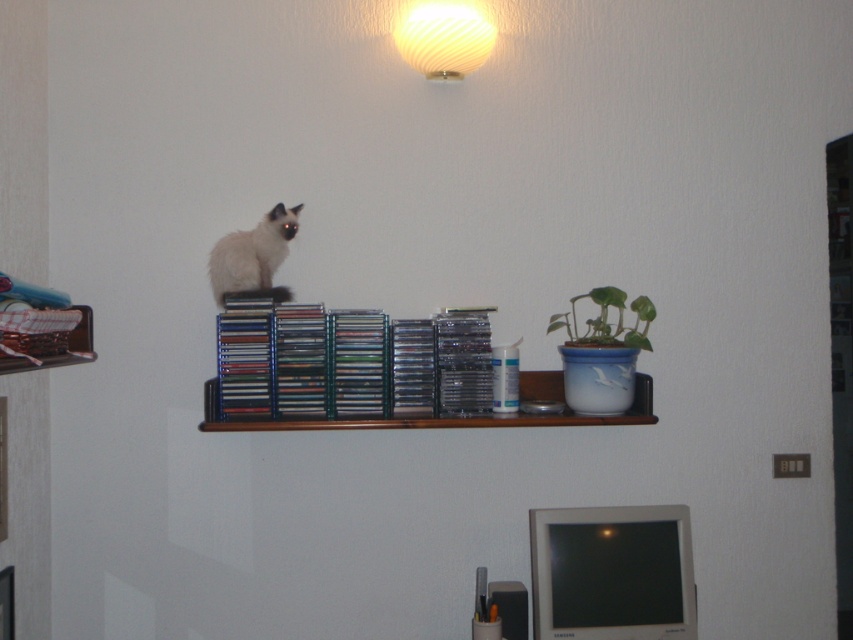
You are a cat owner who wants to ensure your cat is safe. Looking at the image, where is the smokey white fur at upper center located relative to the brown wooden shelf at center?

The smokey white fur at upper center is to the left of the brown wooden shelf at center.

What is the 2D coordinate of the clear plastic cds at center?

The clear plastic cds at center are located at the 2D coordinate point of [357,364].

You are a photographer trying to capture the cat on the shelf. The cat is at point (253,257). Where should you aim your camera to ensure the cat is centered in the photo?

The point (253,257) is on the smokey white fur at upper center, so aim your camera at the upper center area where the smokey white fur is located to center the cat in the photo.